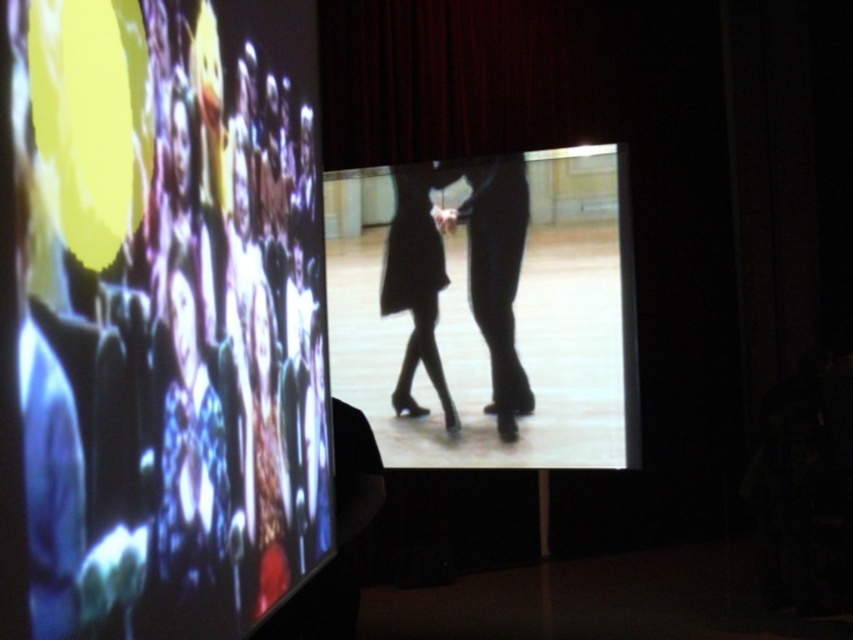
You are an event planner setting up a stage for a fashion show. You have two dresses displayed on screens. The silhouette dress at center is on the left screen and the black matte dress at center is on the right screen. Which dress is closer to the audience?

The silhouette dress at center is in front of the black matte dress at center, so the silhouette dress at center is closer to the audience.

You are an event planner arranging a photoshoot in the auditorium. You need to position two mannequins wearing the silhouette dress at center and the black matte dress at center so that their outfits match the screens. Which dress should be placed closer to the left screen with the vibrant collage?

The silhouette dress at center should be placed closer to the left screen with the vibrant collage because it is positioned to the right of the black matte dress at center, aligning with the dynamic left screen while the darker right screen matches the black matte dress at center.